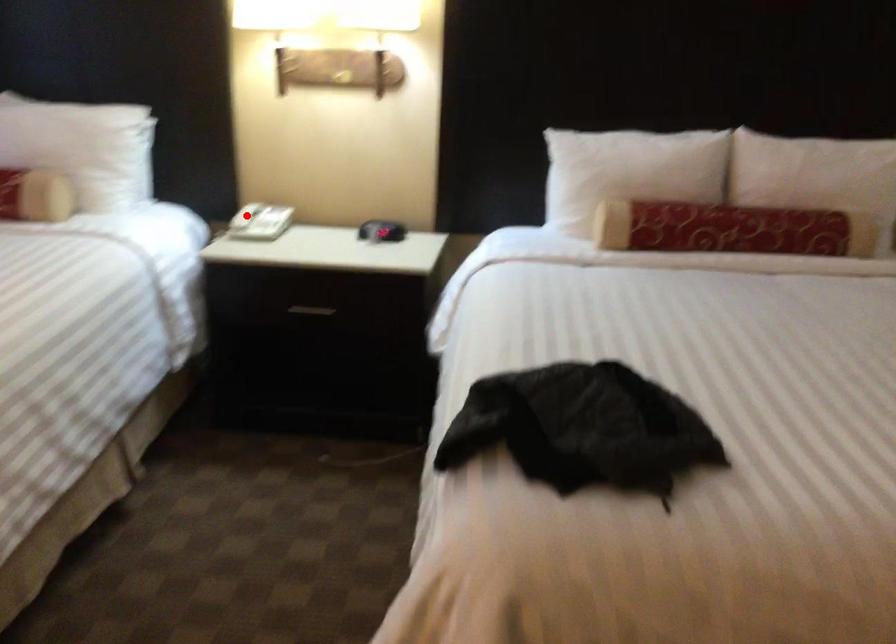
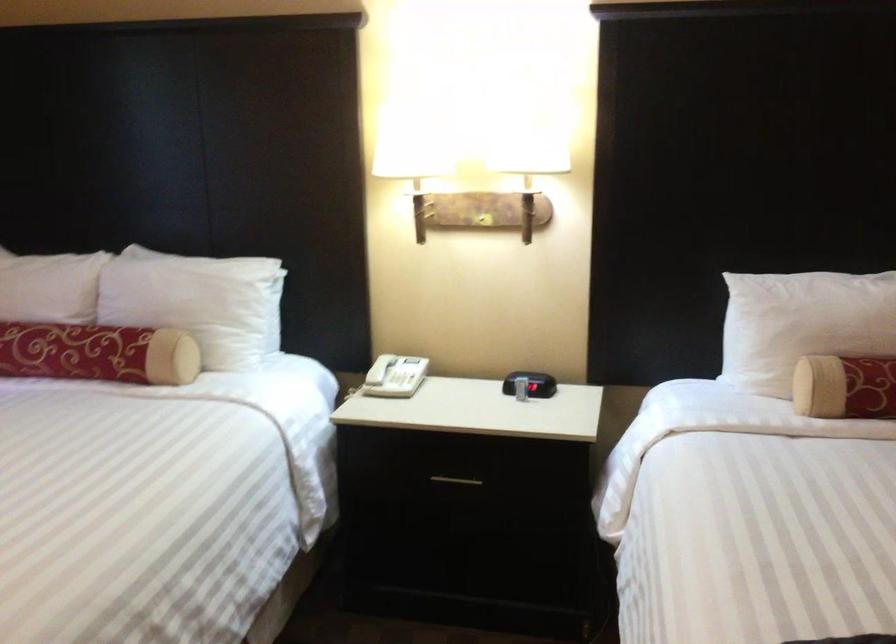
Where in the second image is the point corresponding to the highlighted location from the first image?

(380, 368)